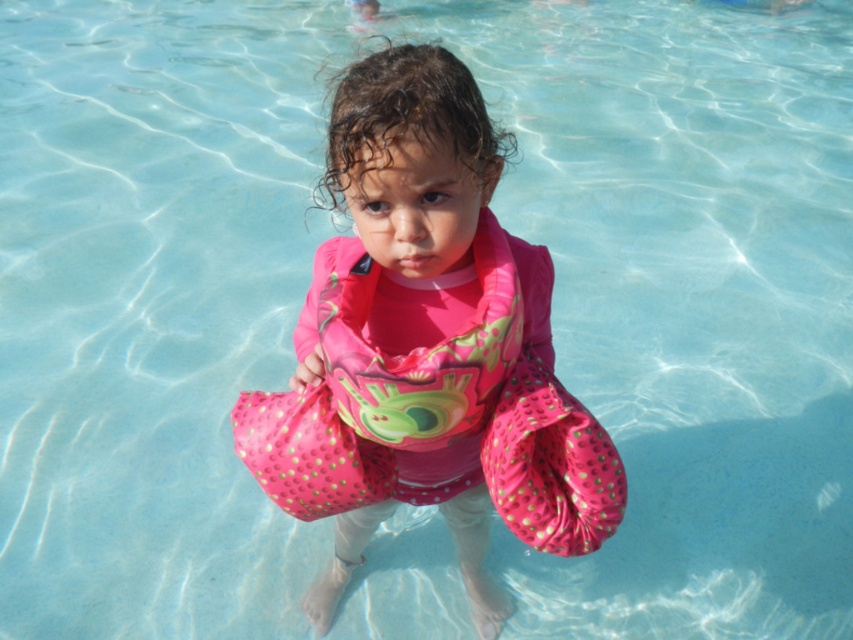
You are a lifeguard assessing the safety equipment for a child in the pool. The child is wearing both the pink fabric floaties at center and the pink fabric life jacket at center. Which of these two items is wider?

The pink fabric floaties at center are wider than the pink fabric life jacket at center according to the description.

You are a photographer trying to capture the child in the swimming pool. You notice two points marked in the image. Which of the two points, point (x=439, y=77) or point (x=511, y=298), is closer to you?

Point (x=439, y=77) is closer to the viewer than point (x=511, y=298).